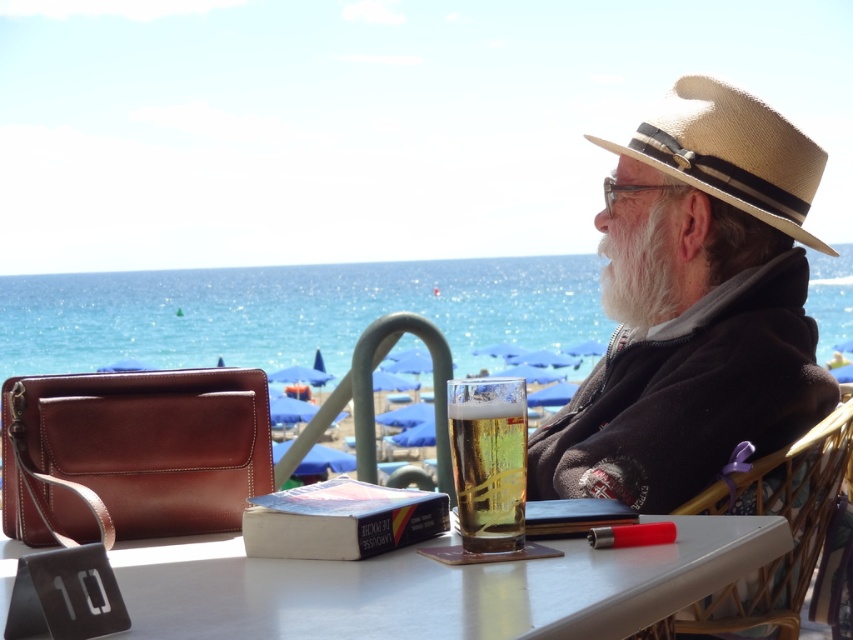
Question: Which object is positioned closest to the straw hat at center?

Choices:
 (A) metallic silver table at center
 (B) metallic gold chair at lower right
 (C) straw hat at upper right

Answer: (C)

Question: Is straw hat at upper right positioned behind metallic gold chair at lower right?

Choices:
 (A) yes
 (B) no

Answer: (A)

Question: Is metallic silver table at center positioned behind white fluffy beard at center?

Choices:
 (A) no
 (B) yes

Answer: (A)

Question: Is straw hat at upper right closer to camera compared to metallic gold chair at lower right?

Choices:
 (A) yes
 (B) no

Answer: (B)

Question: Which of the following is the farthest from the observer?

Choices:
 (A) straw hat at upper right
 (B) metallic silver table at center
 (C) metallic gold chair at lower right
 (D) translucent glass beer at center

Answer: (A)

Question: Which point is closer to the camera?

Choices:
 (A) (767, 448)
 (B) (508, 484)

Answer: (B)